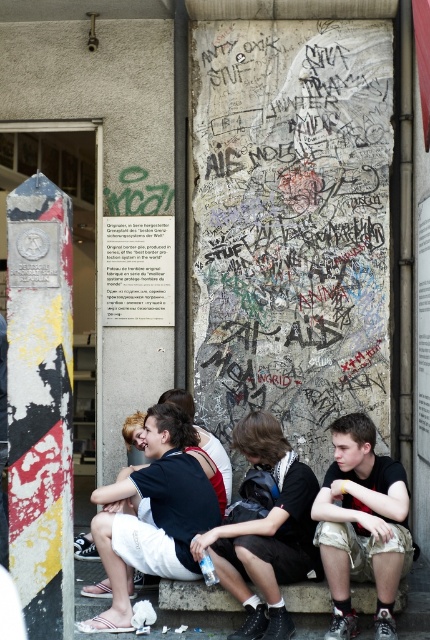
You are a photographer planning to take a wide shot of the grungy concrete wall at center and the dark gray fabric shorts at lower right. Which object should you focus on first if you want to capture both in a single frame without moving the camera?

You should focus on the grungy concrete wall at center first because its width is larger than the dark gray fabric shorts at lower right, making it the dominant subject in the frame.

You are a photographer planning to take a closeup shot of the dark gray fabric shorts at lower right and the dark brown leather jacket at center. Since you want to focus on the shorts, which object should you ensure is in the foreground?

The dark gray fabric shorts at lower right should be in the foreground because it is positioned over the dark brown leather jacket at center, meaning it is closer to the camera.